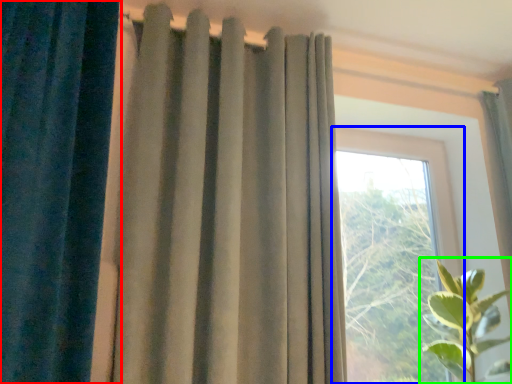
Question: Which is farther away from curtain (highlighted by a red box)? window (highlighted by a blue box) or houseplant (highlighted by a green box)?

Choices:
 (A) window
 (B) houseplant

Answer: (A)